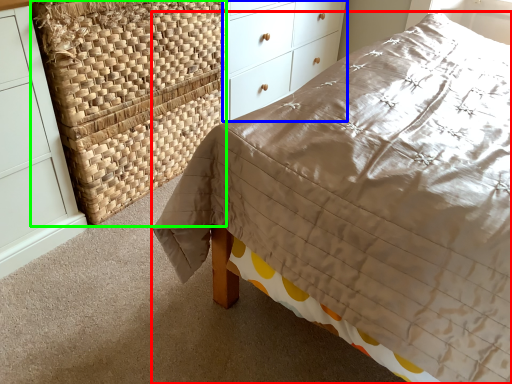
Question: Considering the real-world distances, which object is farthest from bed (highlighted by a red box)? chest of drawers (highlighted by a blue box) or basket (highlighted by a green box)?

Choices:
 (A) chest of drawers
 (B) basket

Answer: (A)